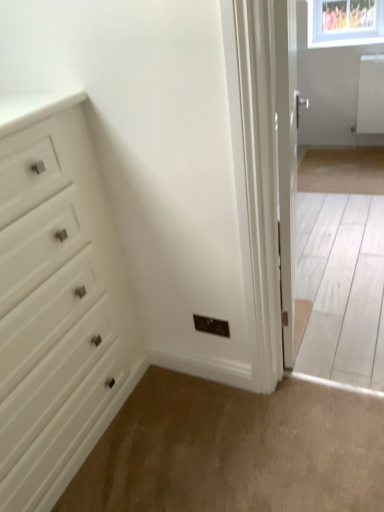
Question: Looking at the image, does white glossy door at right seem bigger or smaller compared to beige carpet at lower center?

Choices:
 (A) big
 (B) small

Answer: (A)

Question: From a real-world perspective, is white glossy door at right physically located above or below beige carpet at lower center?

Choices:
 (A) above
 (B) below

Answer: (A)

Question: Considering the real-world distances, which object is farthest from the beige carpet at lower center?

Choices:
 (A) white glossy door at right
 (B) white matte chest of drawers at left

Answer: (A)

Question: Which object is the farthest from the white matte chest of drawers at left?

Choices:
 (A) white glossy door at right
 (B) beige carpet at lower center

Answer: (A)